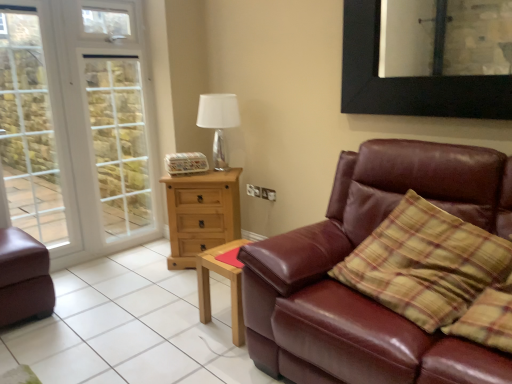
Locate an element on the screen. Image resolution: width=512 pixels, height=384 pixels. free space to the left of light wood rectangular table at center is located at coordinates (183, 324).